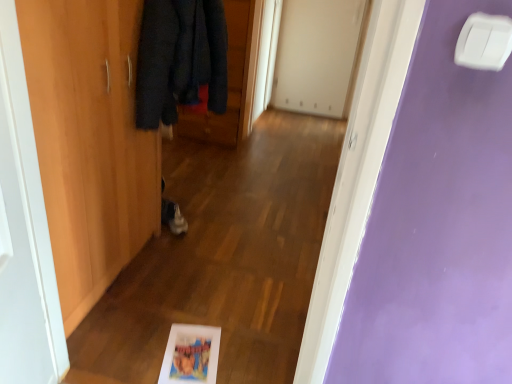
At what (x,y) coordinates should I click in order to perform the action: click on vacant space underneath matte plastic picture frame at lower center (from a real-world perspective). Please return your answer as a coordinate pair (x, y). Looking at the image, I should click on (196, 356).